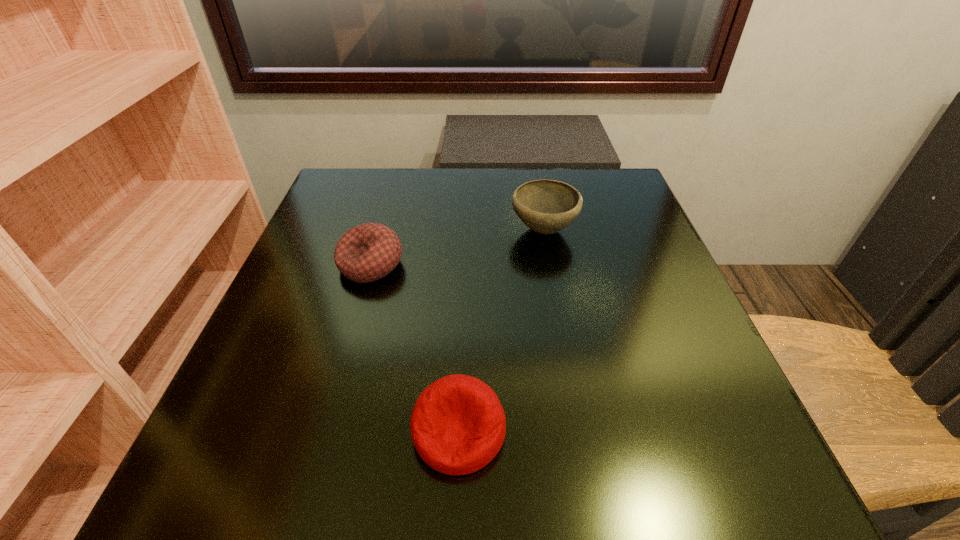
Locate an element on the screen. The image size is (960, 540). vacant region between the right beanbag and the bowl is located at coordinates (x=501, y=330).

Where is `free space between the nearer beanbag and the leftmost object`? free space between the nearer beanbag and the leftmost object is located at coordinates (415, 347).

Find the location of a particular element. The image size is (960, 540). vacant area that lies between the farther beanbag and the nearer beanbag is located at coordinates (415, 347).

This screenshot has width=960, height=540. Find the location of `empty location between the left beanbag and the rightmost object`. empty location between the left beanbag and the rightmost object is located at coordinates (457, 247).

Locate an element on the screen. This screenshot has height=540, width=960. free space between the left beanbag and the rightmost object is located at coordinates (457, 247).

Where is `vacant area that lies between the second object from left to right and the rightmost object`? Image resolution: width=960 pixels, height=540 pixels. vacant area that lies between the second object from left to right and the rightmost object is located at coordinates 501,330.

Where is `object that can be found as the closest to the leftmost object`? Image resolution: width=960 pixels, height=540 pixels. object that can be found as the closest to the leftmost object is located at coordinates (546, 206).

This screenshot has width=960, height=540. Find the location of `object that is the closest one to the right beanbag`. object that is the closest one to the right beanbag is located at coordinates (368, 252).

At what (x,y) coordinates should I click in order to perform the action: click on free space that satisfies the following two spatial constraints: 1. on the back side of the bowl; 2. on the left side of the leftmost object. Please return your answer as a coordinate pair (x, y). Image resolution: width=960 pixels, height=540 pixels. Looking at the image, I should click on (380, 230).

At what (x,y) coordinates should I click in order to perform the action: click on free location that satisfies the following two spatial constraints: 1. on the back side of the farther beanbag; 2. on the left side of the rightmost object. Please return your answer as a coordinate pair (x, y). The width and height of the screenshot is (960, 540). Looking at the image, I should click on (380, 230).